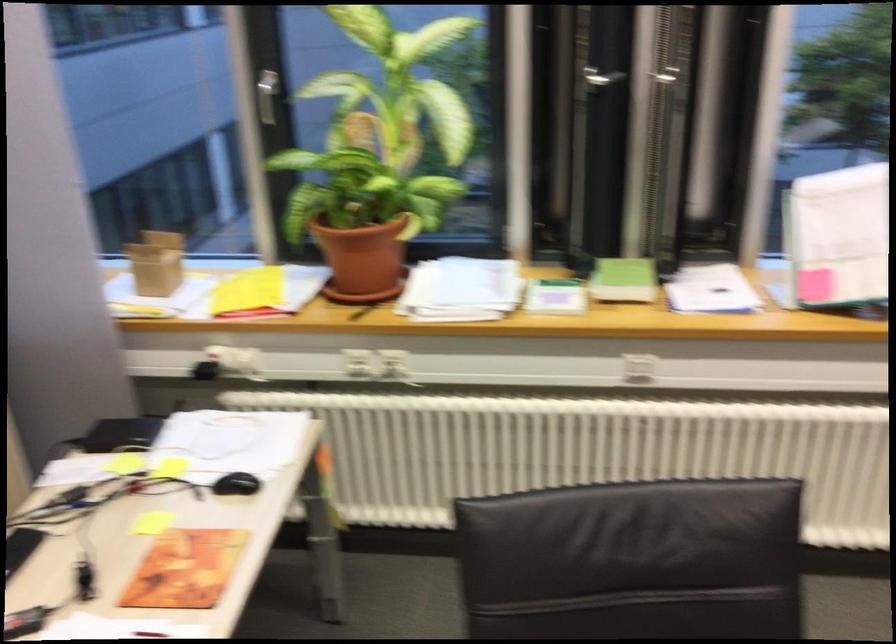
Locate an element on the screen. The height and width of the screenshot is (644, 896). terracotta plant pot is located at coordinates (363, 257).